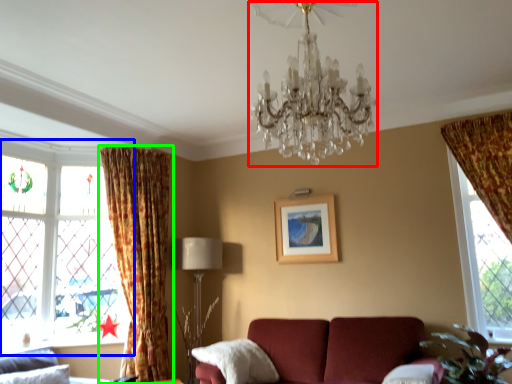
Question: Considering the real-world distances, which object is farthest from chandelier (highlighted by a red box)? window (highlighted by a blue box) or curtain (highlighted by a green box)?

Choices:
 (A) window
 (B) curtain

Answer: (A)